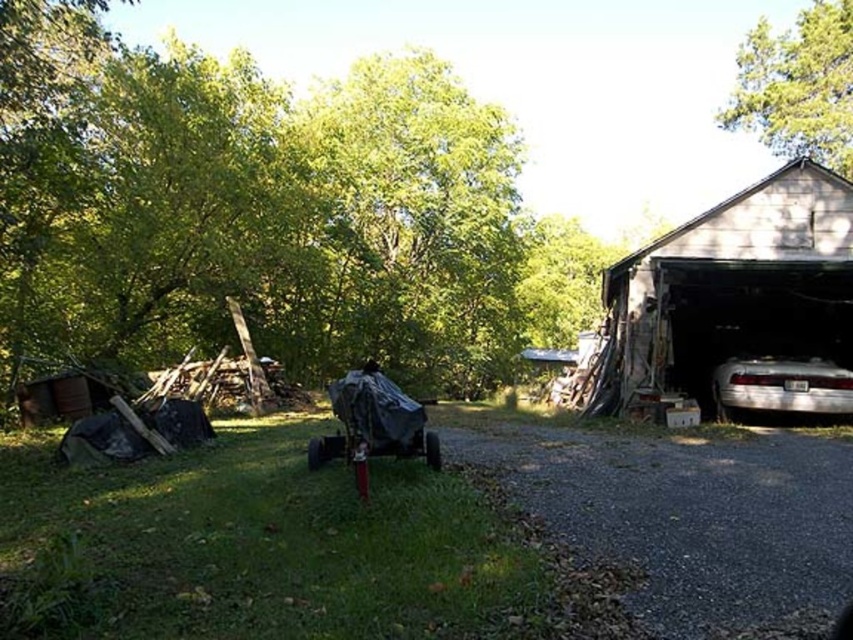
Can you confirm if green leafy tree at upper left is positioned to the left of gray gravel driveway at lower right?

Yes, green leafy tree at upper left is to the left of gray gravel driveway at lower right.

Is point (114, 349) closer to viewer compared to point (790, 461)?

No, it is behind (790, 461).

Find the location of a particular element. The width and height of the screenshot is (853, 640). green leafy tree at upper left is located at coordinates (257, 211).

Does point (624, 356) come behind point (781, 401)?

Yes.

Between point (747, 228) and point (830, 369), which one is positioned behind?

Point (747, 228)

Locate an element on the screen. white wood barn at right is located at coordinates coord(738,305).

Does white wood barn at right come behind green leafy tree at upper right?

No, it is in front of green leafy tree at upper right.

Who is more distant from viewer, (734, 328) or (833, 51)?

Point (833, 51)

Is point (833, 269) less distant than point (849, 42)?

Yes, it is.

You are a GUI agent. You are given a task and a screenshot of the screen. Output one action in this format:
    pyautogui.click(x=<x>, y=<y>)
    Task: Click on the white wood barn at right
    
    Given the screenshot: What is the action you would take?
    (x=738, y=305)